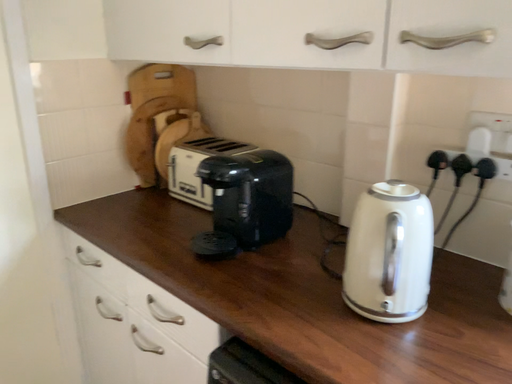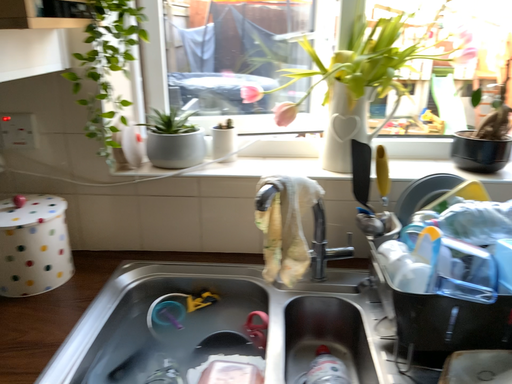
Question: How did the camera likely rotate when shooting the video?

Choices:
 (A) rotated left
 (B) rotated right

Answer: (B)